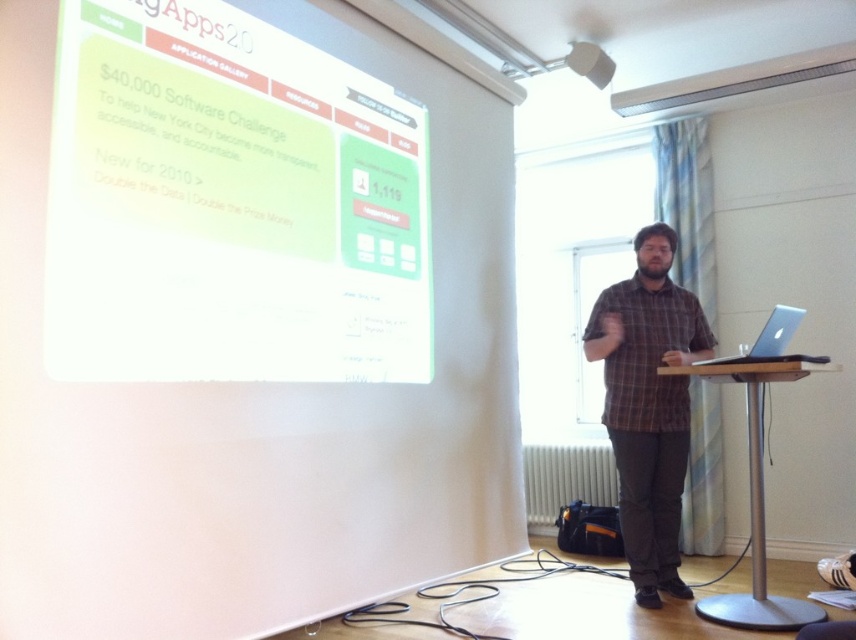
Is white glossy projection screen at upper left bigger than silver metallic laptop at right?

Indeed, white glossy projection screen at upper left has a larger size compared to silver metallic laptop at right.

Who is more distant from viewer, [307,145] or [770,337]?

Point [770,337]

What do you see at coordinates (230, 204) in the screenshot? The image size is (856, 640). I see `white glossy projection screen at upper left` at bounding box center [230, 204].

This screenshot has width=856, height=640. Find the location of `white glossy projection screen at upper left`. white glossy projection screen at upper left is located at coordinates (230, 204).

Which is more to the right, silver metallic podium at center or matte black shirt at center?

silver metallic podium at center is more to the right.

Which of these two, silver metallic podium at center or matte black shirt at center, stands shorter?

With less height is matte black shirt at center.

Locate an element on the screen. silver metallic podium at center is located at coordinates (755, 502).

Looking at this image, between white glossy projection screen at upper left and brown plaid shirt at center, which one appears on the right side from the viewer's perspective?

brown plaid shirt at center

Consider the image. Who is positioned more to the left, white glossy projection screen at upper left or brown plaid shirt at center?

Positioned to the left is white glossy projection screen at upper left.

Is point (400, 113) behind point (599, 323)?

That is False.

At what (x,y) coordinates should I click in order to perform the action: click on white glossy projection screen at upper left. Please return your answer as a coordinate pair (x, y). Looking at the image, I should click on (230, 204).